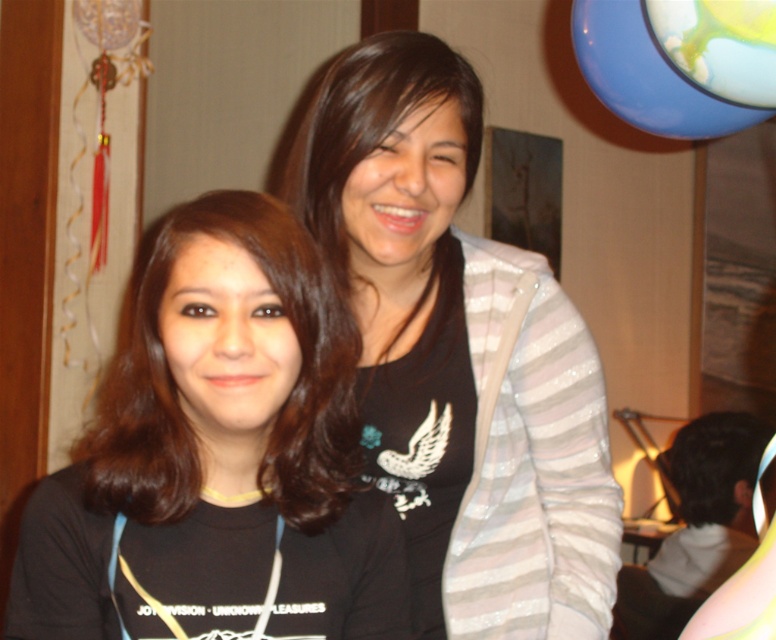
Who is shorter, matte black shirt at center or black matte shirt at center?

black matte shirt at center is shorter.

What do you see at coordinates (456, 353) in the screenshot? The width and height of the screenshot is (776, 640). I see `matte black shirt at center` at bounding box center [456, 353].

Locate an element on the screen. This screenshot has width=776, height=640. matte black shirt at center is located at coordinates (456, 353).